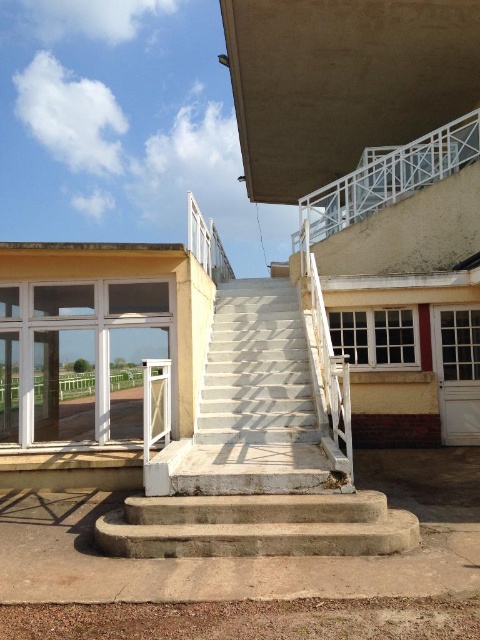
Looking at this image, can you confirm if white concrete stairs at center is wider than concrete stairs at center?

No, white concrete stairs at center is not wider than concrete stairs at center.

Is white concrete stairs at center below concrete stairs at center?

Incorrect, white concrete stairs at center is not positioned below concrete stairs at center.

Where is `white concrete stairs at center`? This screenshot has width=480, height=640. white concrete stairs at center is located at coordinates pyautogui.click(x=255, y=404).